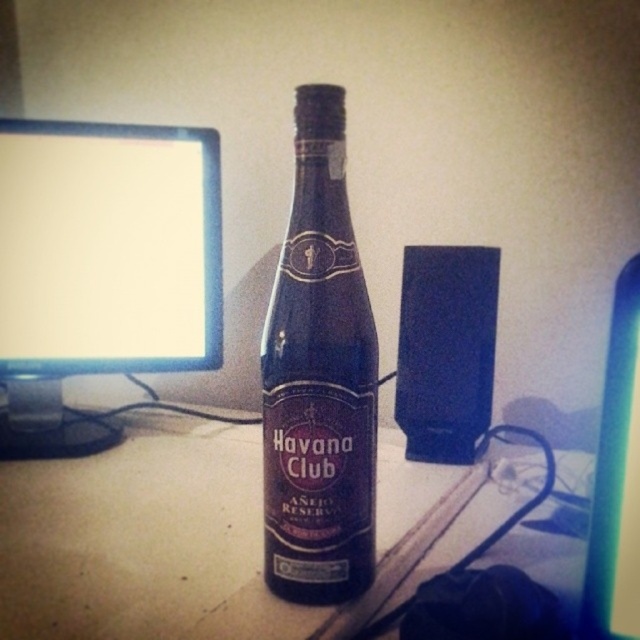
Which is behind, point (189, 349) or point (346, 288)?

The point (189, 349) is behind.

Where is `matte black monitor at left`? matte black monitor at left is located at coordinates (100, 268).

Is point (214, 141) closer to viewer compared to point (368, 380)?

No.

Identify the location of matte black monitor at left. The image size is (640, 640). (100, 268).

Where is `matte plastic computer desk at center`? The image size is (640, 640). matte plastic computer desk at center is located at coordinates (145, 541).

Which is below, matte plastic computer desk at center or matte black monitor at left?

Positioned lower is matte plastic computer desk at center.

Which is behind, point (243, 580) or point (90, 452)?

The point (90, 452) is behind.

Locate an element on the screen. matte plastic computer desk at center is located at coordinates (145, 541).

Looking at this image, who is positioned more to the right, matte plastic computer desk at center or dark glass bottle at center?

From the viewer's perspective, matte plastic computer desk at center appears more on the right side.

From the picture: Can you confirm if matte plastic computer desk at center is positioned above dark glass bottle at center?

No.

Is point (100, 460) less distant than point (288, 592)?

No, (100, 460) is further to viewer.

Locate an element on the screen. Image resolution: width=640 pixels, height=640 pixels. matte plastic computer desk at center is located at coordinates (145, 541).